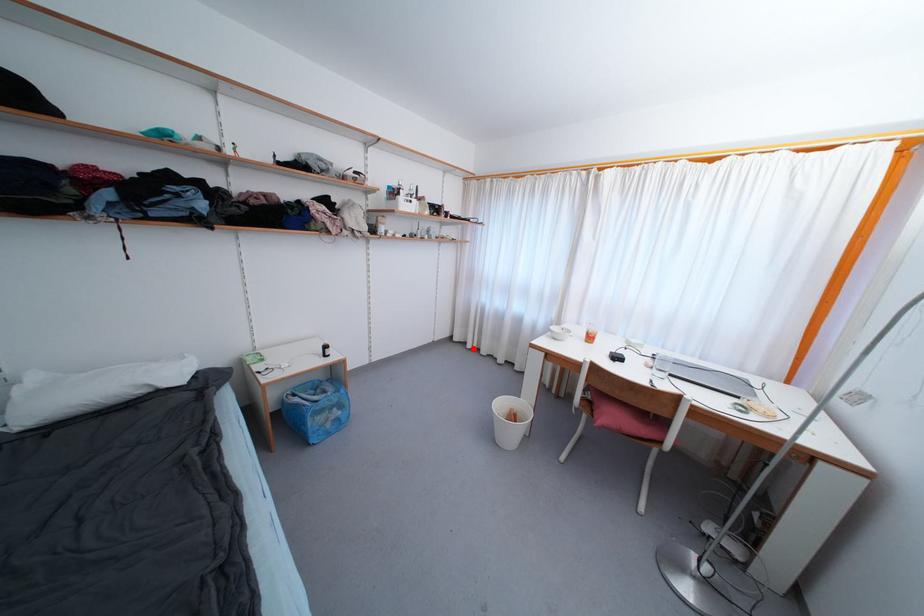
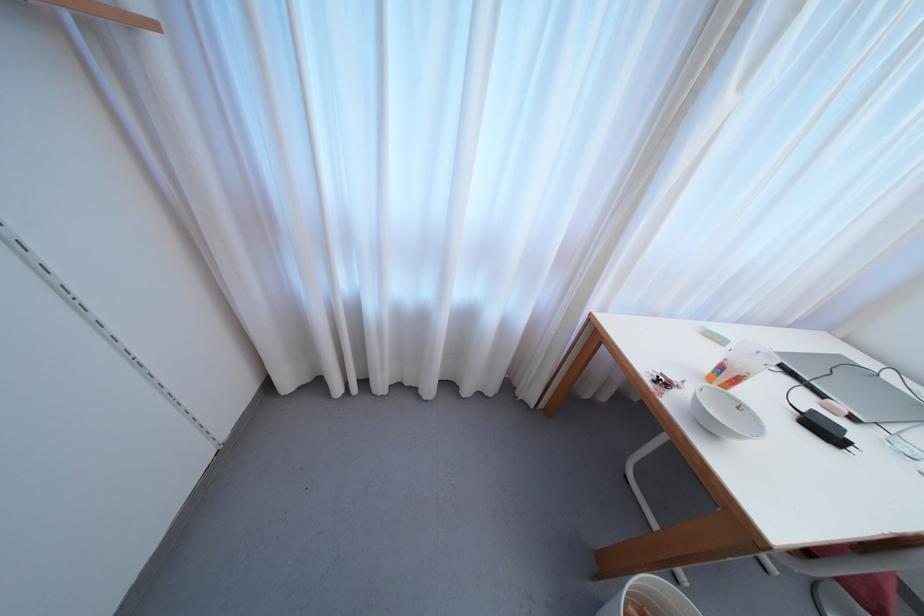
Question: I am providing you with two images of the same scene from different viewpoints. In image1, a red point is highlighted. Considering the same 3D point in image2, which of the following is correct?

Choices:
 (A) It is closer
 (B) It is farther

Answer: (B)